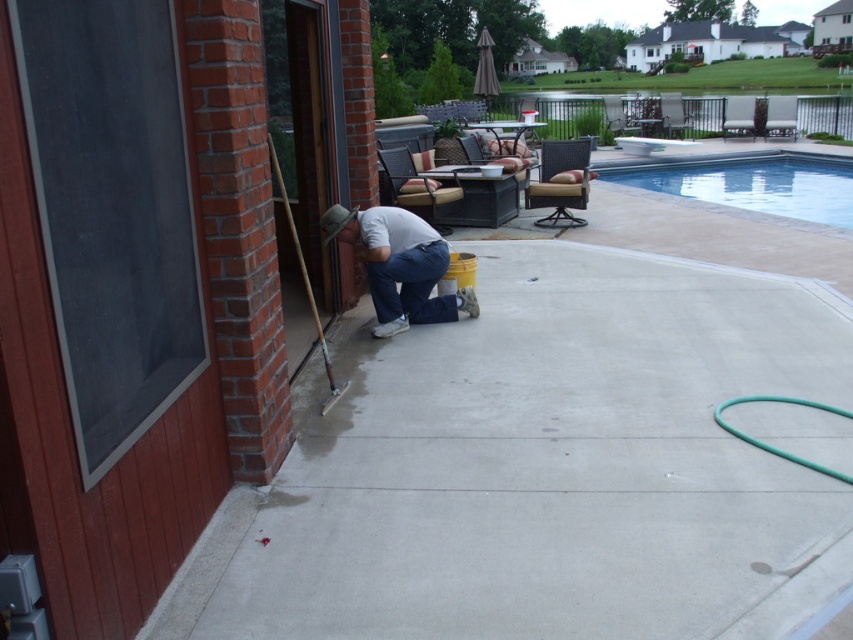
Is smooth concrete at center smaller than denim jeans at lower center?

Incorrect, smooth concrete at center is not smaller in size than denim jeans at lower center.

Is point (540, 531) farther from viewer compared to point (339, 218)?

No, it is in front of (339, 218).

Find the location of a particular element. The image size is (853, 640). smooth concrete at center is located at coordinates (540, 467).

Is smooth concrete at center closer to camera compared to clear glass swimming pool at upper right?

Yes, smooth concrete at center is in front of clear glass swimming pool at upper right.

Can you confirm if smooth concrete at center is thinner than clear glass swimming pool at upper right?

Yes.

I want to click on smooth concrete at center, so click(540, 467).

Does clear glass swimming pool at upper right come in front of denim jeans at lower center?

No, clear glass swimming pool at upper right is behind denim jeans at lower center.

Who is higher up, clear glass swimming pool at upper right or denim jeans at lower center?

clear glass swimming pool at upper right is higher up.

Identify the location of clear glass swimming pool at upper right. (747, 180).